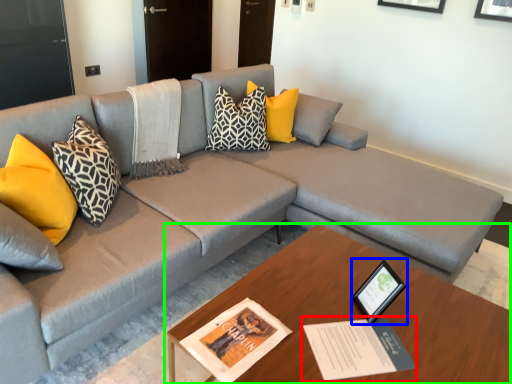
Question: Considering the real-world distances, which object is closest to book (highlighted by a red box)? picture frame (highlighted by a blue box) or table (highlighted by a green box).

Choices:
 (A) picture frame
 (B) table

Answer: (A)